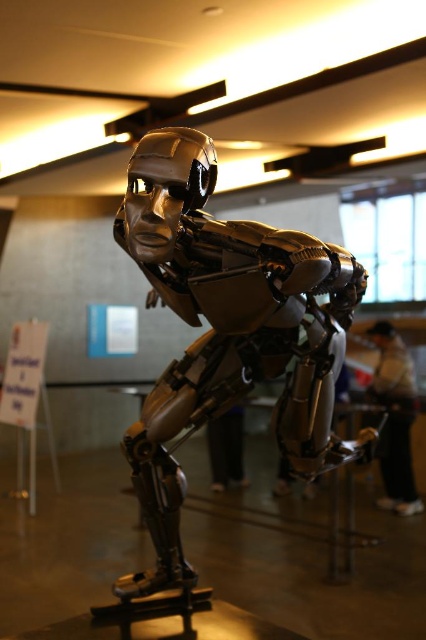
Which of these two, metallic gold robot at center or dark gray fabric jacket at lower right, stands taller?

Standing taller between the two is metallic gold robot at center.

Is point (155, 460) less distant than point (408, 468)?

Yes, point (155, 460) is closer to viewer.

Where is `metallic gold robot at center`? metallic gold robot at center is located at coordinates (224, 344).

Which is below, dark gray fabric jacket at lower right or black matte pants at lower center?

black matte pants at lower center is below.

Is dark gray fabric jacket at lower right smaller than black matte pants at lower center?

Incorrect, dark gray fabric jacket at lower right is not smaller in size than black matte pants at lower center.

Between point (397, 492) and point (212, 426), which one is positioned in front?

Point (397, 492)

Identify the location of dark gray fabric jacket at lower right. The height and width of the screenshot is (640, 426). (394, 419).

Does metallic gold robot at center have a greater height compared to black matte pants at lower center?

Yes, metallic gold robot at center is taller than black matte pants at lower center.

Which is in front, point (198, 262) or point (241, 452)?

Positioned in front is point (198, 262).

At what (x,y) coordinates should I click in order to perform the action: click on metallic gold robot at center. Please return your answer as a coordinate pair (x, y). Image resolution: width=426 pixels, height=640 pixels. Looking at the image, I should click on (224, 344).

The image size is (426, 640). Find the location of `metallic gold robot at center`. metallic gold robot at center is located at coordinates (224, 344).